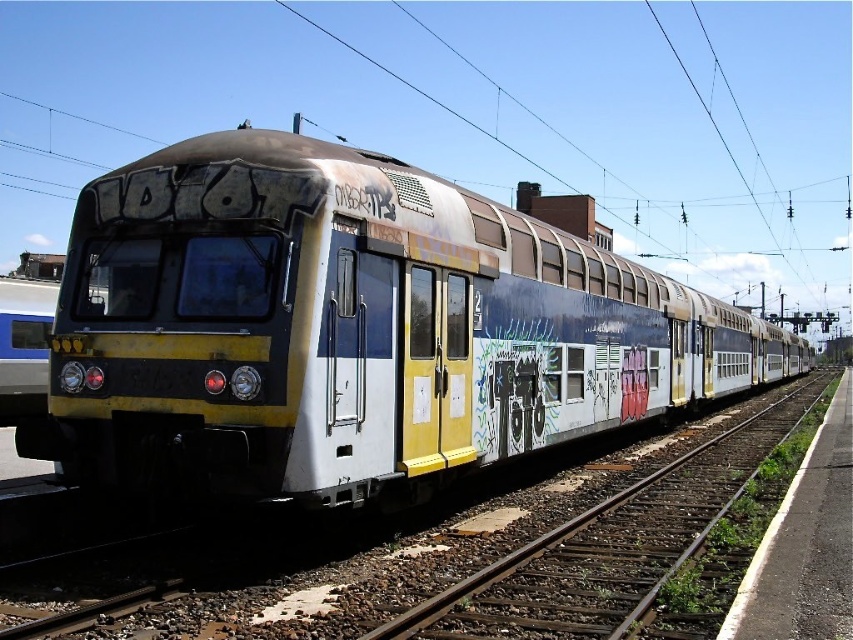
You are a passenger waiting on the platform. You see the yellow matte train at center and the smooth metal train track at center. Which object is closer to you?

The yellow matte train at center is closer to you than the smooth metal train track at center because it is positioned further to the viewer.

You are a maintenance worker inspecting the train tracks. You notice the yellow matte train at center and the smooth metal train track at center. Which object is positioned higher from the ground?

The yellow matte train at center is above the smooth metal train track at center, so it is positioned higher from the ground.

You are standing on the platform at the railway station. You see a point marked at coordinates (351, 328). What does this point indicate?

The point at coordinates (351, 328) marks the yellow matte train at center.